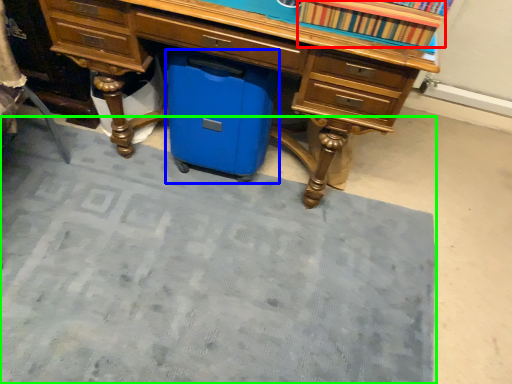
Question: Which is farther away from book (highlighted by a red box)? cooler (highlighted by a blue box) or doormat (highlighted by a green box)?

Choices:
 (A) cooler
 (B) doormat

Answer: (B)